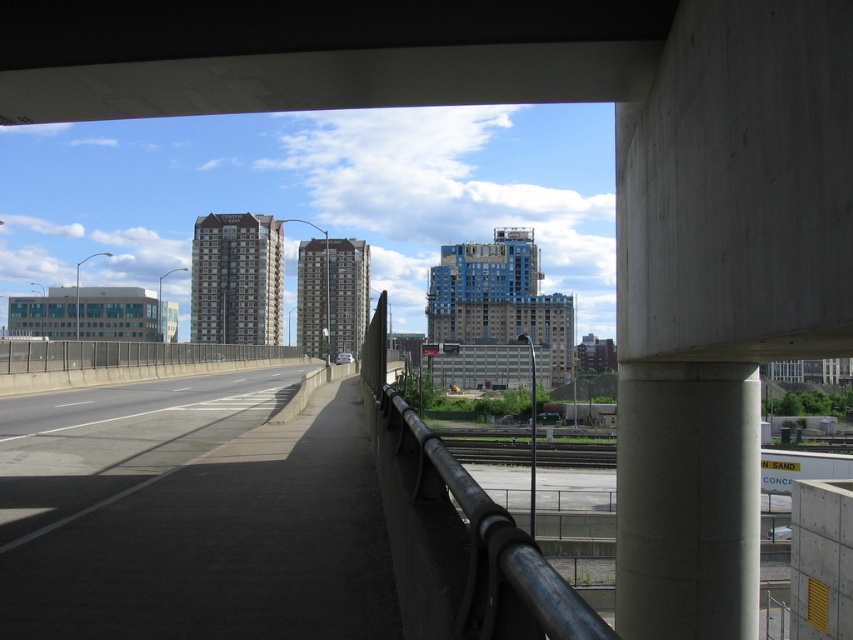
Is concrete at upper center above black metal/rail at center?

Yes, concrete at upper center is above black metal/rail at center.

Between point (113, 29) and point (448, 500), which one is positioned in front?

Point (448, 500) is more forward.

Measure the distance between concrete at upper center and camera.

A distance of 8.43 meters exists between concrete at upper center and camera.

Locate an element on the screen. The height and width of the screenshot is (640, 853). concrete at upper center is located at coordinates (317, 54).

In the scene shown: Is black asphalt highway at lower left thinner than gray concrete pillar at center-right?

No, black asphalt highway at lower left is not thinner than gray concrete pillar at center-right.

Between black asphalt highway at lower left and gray concrete pillar at center-right, which one appears on the right side from the viewer's perspective?

Positioned to the right is gray concrete pillar at center-right.

This screenshot has height=640, width=853. Find the location of `black asphalt highway at lower left`. black asphalt highway at lower left is located at coordinates (190, 513).

Is gray concrete pillar at center-right to the left of black metal/rail at center from the viewer's perspective?

Incorrect, gray concrete pillar at center-right is not on the left side of black metal/rail at center.

Is gray concrete pillar at center-right bigger than black metal/rail at center?

Actually, gray concrete pillar at center-right might be smaller than black metal/rail at center.

The image size is (853, 640). I want to click on gray concrete pillar at center-right, so click(x=688, y=500).